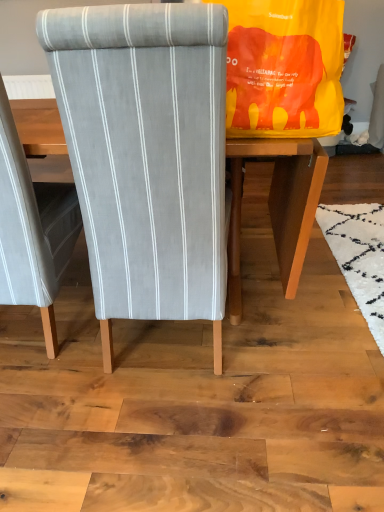
Find the location of `free point to the right of gray fabric chair at center, the 1th chair from the right`. free point to the right of gray fabric chair at center, the 1th chair from the right is located at coordinates (289, 334).